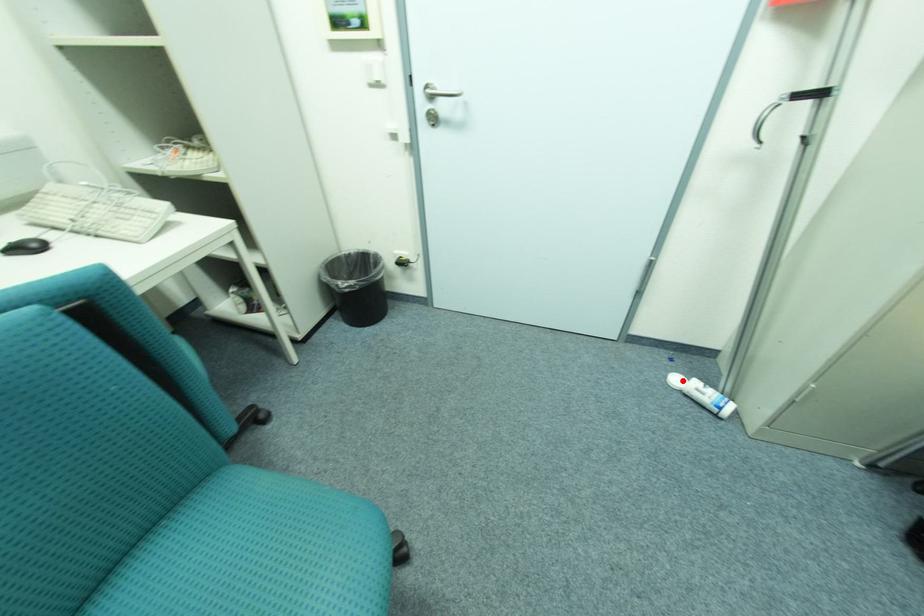
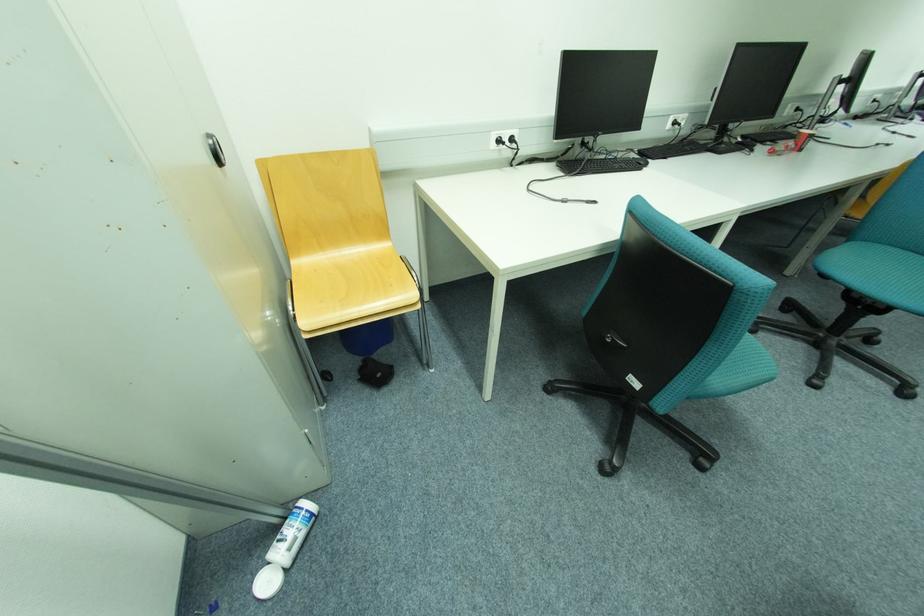
In the second image, find the point that corresponds to the highlighted location in the first image.

(274, 584)